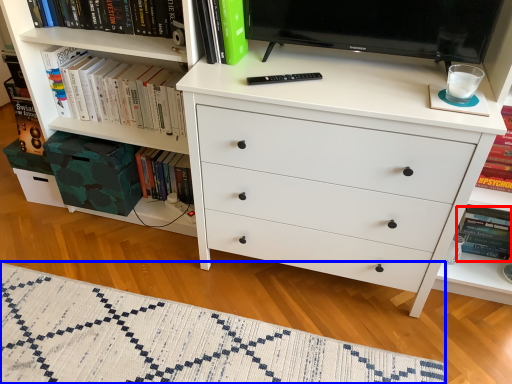
Question: Which of the following is the farthest to the observer, paperback book (highlighted by a red box) or blanket (highlighted by a blue box)?

Choices:
 (A) paperback book
 (B) blanket

Answer: (A)